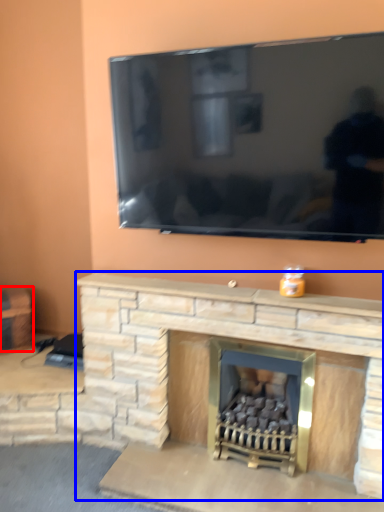
Question: Among these objects, which one is nearest to the camera, furniture (highlighted by a red box) or fireplace (highlighted by a blue box)?

Choices:
 (A) furniture
 (B) fireplace

Answer: (B)